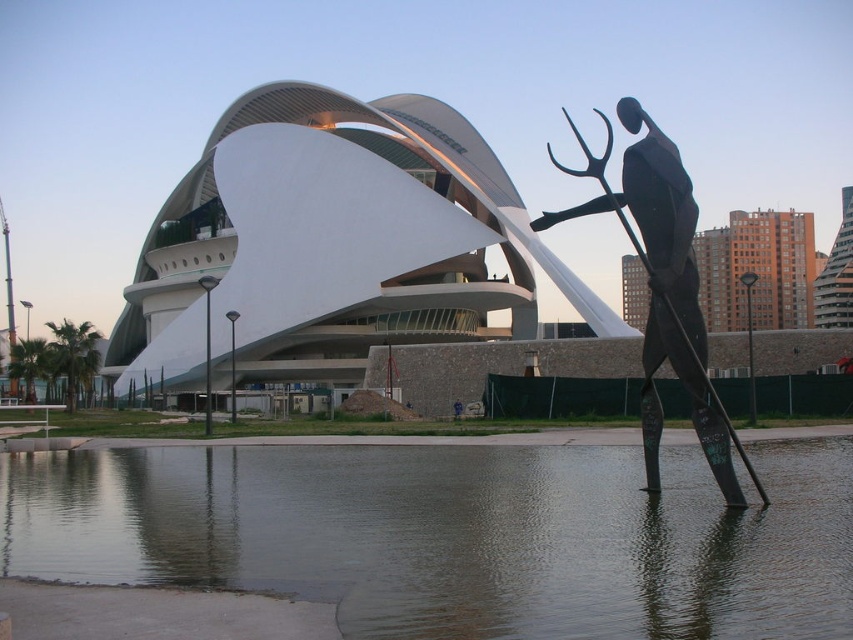
Between clear water at lower center and black metal trident at right, which one appears on the right side from the viewer's perspective?

black metal trident at right

Is clear water at lower center to the left of black metal trident at right from the viewer's perspective?

Indeed, clear water at lower center is positioned on the left side of black metal trident at right.

Who is more distant from viewer, (762, 522) or (637, 177)?

Point (637, 177)

At what (x,y) coordinates should I click in order to perform the action: click on clear water at lower center. Please return your answer as a coordinate pair (x, y). This screenshot has height=640, width=853. Looking at the image, I should click on (454, 536).